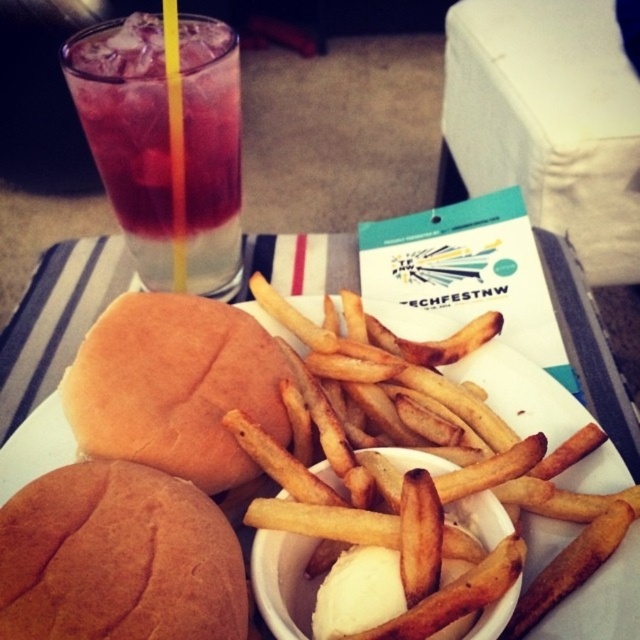
Can you confirm if translucent glass at upper left is thinner than brown soft bun at center?

No, translucent glass at upper left is not thinner than brown soft bun at center.

Who is more distant from viewer, (189, 115) or (140, 433)?

Positioned behind is point (189, 115).

Find the location of a particular element. translucent glass at upper left is located at coordinates coord(164,144).

Where is `translucent glass at upper left`? The image size is (640, 640). translucent glass at upper left is located at coordinates (164, 144).

Between translucent glass at upper left and golden crispy french fries at center, which one has less height?

With less height is golden crispy french fries at center.

Image resolution: width=640 pixels, height=640 pixels. What are the coordinates of `translucent glass at upper left` in the screenshot? It's located at (164, 144).

The height and width of the screenshot is (640, 640). Identify the location of translucent glass at upper left. (164, 144).

Who is more forward, (161,545) or (84,342)?

Point (161,545) is more forward.

Which is more to the right, brown matte bun at lower left or brown soft bun at center?

brown soft bun at center

This screenshot has height=640, width=640. I want to click on brown matte bun at lower left, so click(x=116, y=557).